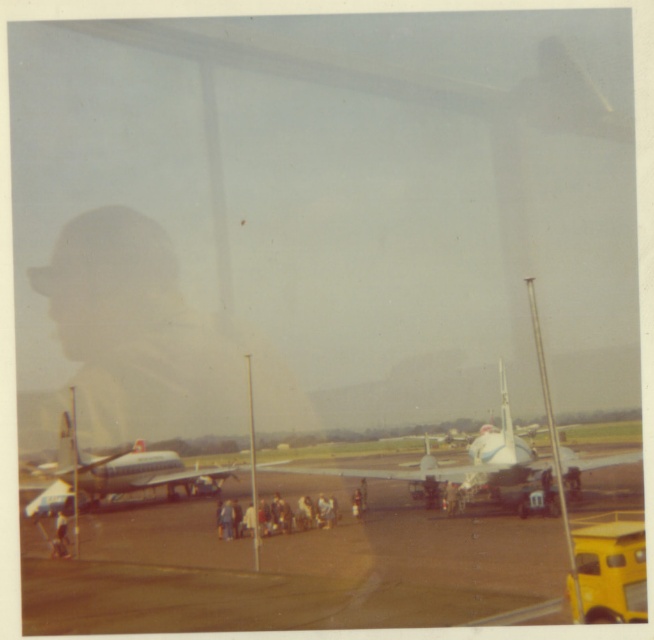
Does silver metallic airplane at center have a smaller size compared to light beige fabric person at lower left?

Actually, silver metallic airplane at center might be larger than light beige fabric person at lower left.

Is point (103, 474) farther from camera compared to point (63, 532)?

Yes, point (103, 474) is farther from viewer.

Identify the location of silver metallic airplane at center. (109, 474).

Does smooth asphalt tarmac at center have a smaller size compared to light brown leather jacket at center?

No.

In order to click on smooth asphalt tarmac at center in this screenshot , I will do `click(301, 557)`.

The width and height of the screenshot is (654, 640). I want to click on smooth asphalt tarmac at center, so click(301, 557).

This screenshot has height=640, width=654. Describe the element at coordinates (301, 557) in the screenshot. I see `smooth asphalt tarmac at center` at that location.

Image resolution: width=654 pixels, height=640 pixels. Find the location of `smooth asphalt tarmac at center`. smooth asphalt tarmac at center is located at coordinates (301, 557).

The width and height of the screenshot is (654, 640). Identify the location of smooth asphalt tarmac at center. [x=301, y=557].